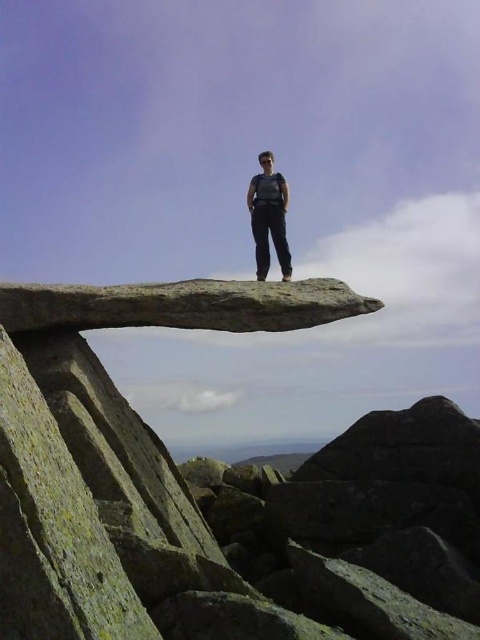
Between point (47, 616) and point (257, 205), which one is positioned in front?

Point (47, 616)

Is gray rough rock at center further to the viewer compared to matte black pants at center?

No.

Measure the distance between gray rough rock at center and camera.

The distance of gray rough rock at center from camera is 4.55 meters.

The height and width of the screenshot is (640, 480). I want to click on gray rough rock at center, so click(218, 492).